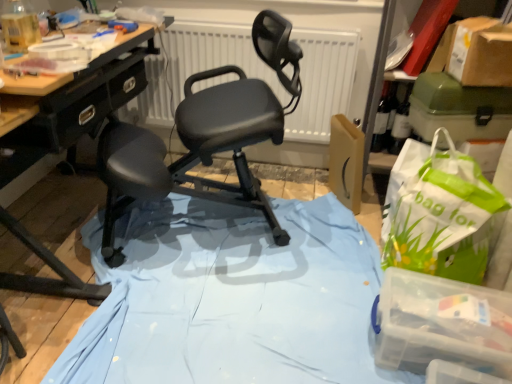
Identify the location of free space above transparent plastic container at lower right, acting as the first box starting from the front (from a real-world perspective). (448, 316).